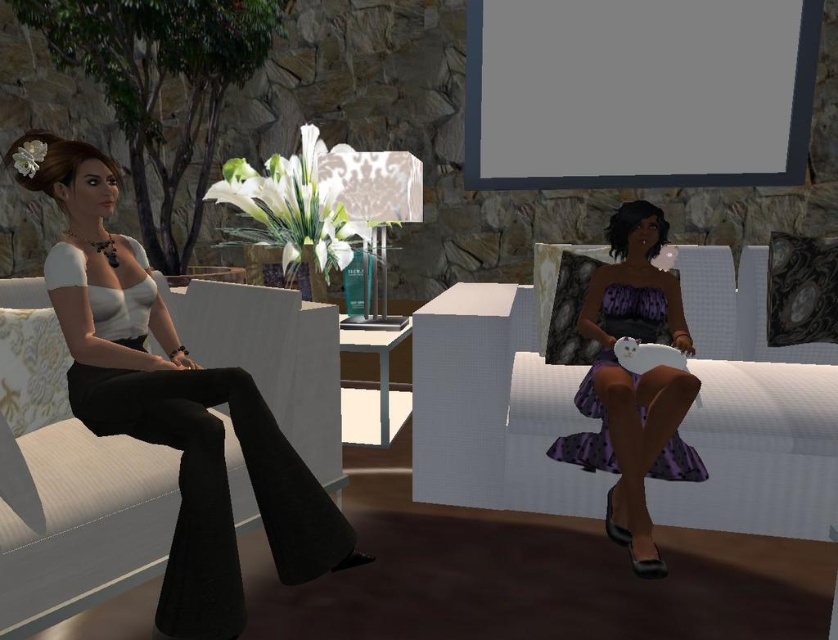
Question: Does white textured couch at right appear on the left side of matte black pants at left?

Choices:
 (A) yes
 (B) no

Answer: (B)

Question: Which is nearer to the purple satin dress at right?

Choices:
 (A) white textured couch at right
 (B) matte black pants at left

Answer: (A)

Question: Can you confirm if white textured couch at right is smaller than matte black pants at left?

Choices:
 (A) no
 (B) yes

Answer: (A)

Question: Which is nearer to the purple satin dress at right?

Choices:
 (A) matte black pants at left
 (B) white textured couch at right

Answer: (B)

Question: Can you confirm if white textured couch at right is thinner than purple satin dress at right?

Choices:
 (A) no
 (B) yes

Answer: (A)

Question: Among these objects, which one is farthest from the camera?

Choices:
 (A) purple satin dress at right
 (B) white textured couch at right
 (C) matte black pants at left

Answer: (B)